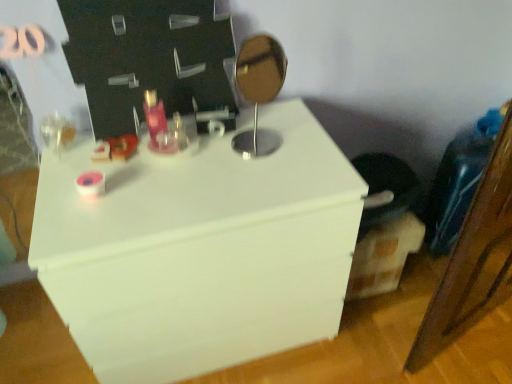
Identify the location of empty space that is ontop of white matte dresser at center. The image size is (512, 384). (198, 166).